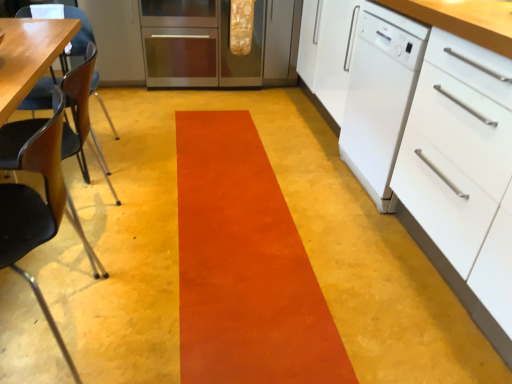
This screenshot has height=384, width=512. Describe the element at coordinates (217, 44) in the screenshot. I see `stainless steel oven at center` at that location.

Find the location of `wooden chair at left, which is the 1th chair in back-to-front order`. wooden chair at left, which is the 1th chair in back-to-front order is located at coordinates (78, 104).

How different are the orientations of white matte drawer at right and stainless steel oven at center in degrees?

They differ by 90.1 degrees in their facing directions.

In the scene shown: Based on their sizes in the image, would you say white matte drawer at right is bigger or smaller than stainless steel oven at center?

Considering their sizes, white matte drawer at right takes up more space than stainless steel oven at center.

From a real-world perspective, who is located lower, white matte drawer at right or stainless steel oven at center?

stainless steel oven at center.

Considering the positions of point (10, 166) and point (69, 94), is point (10, 166) closer or farther from the camera than point (69, 94)?

Point (10, 166) is positioned closer to the camera compared to point (69, 94).

Is black plastic chair at left, the 2th chair positioned from the back, taller or shorter than wooden chair at left, which is the 1th chair in back-to-front order?

Clearly, black plastic chair at left, the 2th chair positioned from the back, is taller compared to wooden chair at left, which is the 1th chair in back-to-front order.

Is black plastic chair at left, the 2th chair positioned from the back, facing away from wooden chair at left, which is the 1th chair in back-to-front order?

No, wooden chair at left, which is the 1th chair in back-to-front order, is not at the back of black plastic chair at left, the 2th chair positioned from the back.

Considering the sizes of wooden chair at left, which is the 1th chair in back-to-front order, and white glossy dishwasher at right in the image, is wooden chair at left, which is the 1th chair in back-to-front order, wider or thinner than white glossy dishwasher at right?

In the image, wooden chair at left, which is the 1th chair in back-to-front order, appears to be more narrow than white glossy dishwasher at right.

Is wooden chair at left, the 2th chair from the front, closer to the viewer compared to white glossy dishwasher at right?

No, wooden chair at left, the 2th chair from the front, is behind white glossy dishwasher at right.

The height and width of the screenshot is (384, 512). Find the location of `chair behind the white glossy dishwasher at right`. chair behind the white glossy dishwasher at right is located at coordinates (78, 104).

From the image's perspective, which object appears higher, wooden chair at left, which is the 1th chair in back-to-front order, or white glossy dishwasher at right?

wooden chair at left, which is the 1th chair in back-to-front order.

Can you confirm if white matte drawer at right is wider than black plastic chair at left, acting as the first chair starting from the front?

Correct, the width of white matte drawer at right exceeds that of black plastic chair at left, acting as the first chair starting from the front.

Can you confirm if white matte drawer at right is positioned to the left of black plastic chair at left, acting as the first chair starting from the front?

Incorrect, white matte drawer at right is not on the left side of black plastic chair at left, acting as the first chair starting from the front.

Is white matte drawer at right far away from black plastic chair at left, the 2th chair positioned from the back?

Yes, white matte drawer at right and black plastic chair at left, the 2th chair positioned from the back, are located far from each other.

Is white matte drawer at right taller than black plastic chair at left, acting as the first chair starting from the front?

Yes.

What's the angular difference between orange suede rug at center and wooden chair at left, the 2th chair from the front,'s facing directions?

They differ by 180 degrees in their facing directions.

Based on the photo, who is taller, orange suede rug at center or wooden chair at left, which is the 1th chair in back-to-front order?

wooden chair at left, which is the 1th chair in back-to-front order, is taller.

Between orange suede rug at center and wooden chair at left, which is the 1th chair in back-to-front order, which one is positioned in front?

orange suede rug at center.

Considering the sizes of objects orange suede rug at center and wooden chair at left, which is the 1th chair in back-to-front order, in the image provided, who is smaller, orange suede rug at center or wooden chair at left, which is the 1th chair in back-to-front order,?

orange suede rug at center is smaller.

Is white glossy dishwasher at right facing towards white matte drawer at right?

No, white glossy dishwasher at right is not facing towards white matte drawer at right.

Considering their positions, is white glossy dishwasher at right located in front of or behind white matte drawer at right?

white glossy dishwasher at right is behind white matte drawer at right.

Is white glossy dishwasher at right next to white matte drawer at right?

white glossy dishwasher at right and white matte drawer at right are clearly separated.

Is black plastic chair at left, the 2th chair positioned from the back, far from white glossy dishwasher at right?

Yes, black plastic chair at left, the 2th chair positioned from the back, and white glossy dishwasher at right are located far from each other.

Can you confirm if black plastic chair at left, acting as the first chair starting from the front, is bigger than white glossy dishwasher at right?

Actually, black plastic chair at left, acting as the first chair starting from the front, might be smaller than white glossy dishwasher at right.

Is black plastic chair at left, acting as the first chair starting from the front, behind white glossy dishwasher at right?

No, it is not.

Which object is positioned more to the left, black plastic chair at left, acting as the first chair starting from the front, or white glossy dishwasher at right?

Positioned to the left is black plastic chair at left, acting as the first chair starting from the front.

The height and width of the screenshot is (384, 512). Identify the location of kitchen appliance behind the white matte drawer at right. (217, 44).

Where is `chair on the left side of black plastic chair at left, the 2th chair positioned from the back`? The height and width of the screenshot is (384, 512). chair on the left side of black plastic chair at left, the 2th chair positioned from the back is located at coordinates (78, 104).

Considering their positions, is orange suede rug at center positioned closer to white matte drawer at right than white glossy dishwasher at right?

white glossy dishwasher at right.

When comparing their distances from stainless steel oven at center, does white glossy dishwasher at right or wooden chair at left, the 2th chair from the front, seem closer?

Based on the image, white glossy dishwasher at right appears to be nearer to stainless steel oven at center.

When comparing their distances from wooden chair at left, which is the 1th chair in back-to-front order, does orange suede rug at center or stainless steel oven at center seem closer?

orange suede rug at center lies closer to wooden chair at left, which is the 1th chair in back-to-front order, than the other object.

When comparing their distances from white glossy dishwasher at right, does wooden chair at left, the 2th chair from the front, or white matte drawer at right seem closer?

Based on the image, white matte drawer at right appears to be nearer to white glossy dishwasher at right.

In the scene shown: From the image, which object appears to be nearer to black plastic chair at left, acting as the first chair starting from the front, white matte drawer at right or wooden chair at left, which is the 1th chair in back-to-front order?

The object closer to black plastic chair at left, acting as the first chair starting from the front, is wooden chair at left, which is the 1th chair in back-to-front order.

When comparing their distances from stainless steel oven at center, does orange suede rug at center or wooden chair at left, the 2th chair from the front, seem closer?

Based on the image, orange suede rug at center appears to be nearer to stainless steel oven at center.

In the scene shown: Estimate the real-world distances between objects in this image. Which object is further from black plastic chair at left, acting as the first chair starting from the front, white glossy dishwasher at right or orange suede rug at center?

white glossy dishwasher at right lies further to black plastic chair at left, acting as the first chair starting from the front, than the other object.

Estimate the real-world distances between objects in this image. Which object is further from black plastic chair at left, the 2th chair positioned from the back, stainless steel oven at center or white matte drawer at right?

stainless steel oven at center is further to black plastic chair at left, the 2th chair positioned from the back.

Locate an element on the screen. home appliance between wooden chair at left, which is the 1th chair in back-to-front order, and white matte drawer at right, in the horizontal direction is located at coordinates (380, 96).

Identify the location of home appliance between orange suede rug at center and stainless steel oven at center along the z-axis. Image resolution: width=512 pixels, height=384 pixels. (380, 96).

Locate an element on the screen. This screenshot has height=384, width=512. strip between black plastic chair at left, the 2th chair positioned from the back, and white glossy dishwasher at right, in the horizontal direction is located at coordinates (245, 265).

The width and height of the screenshot is (512, 384). In order to click on home appliance located between black plastic chair at left, acting as the first chair starting from the front, and white matte drawer at right in the left-right direction in this screenshot , I will do `click(380, 96)`.